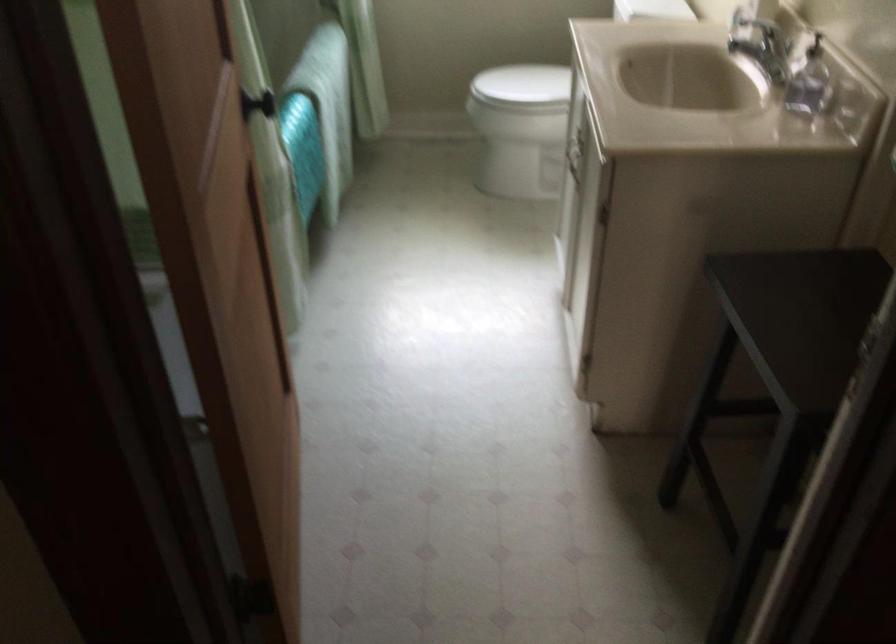
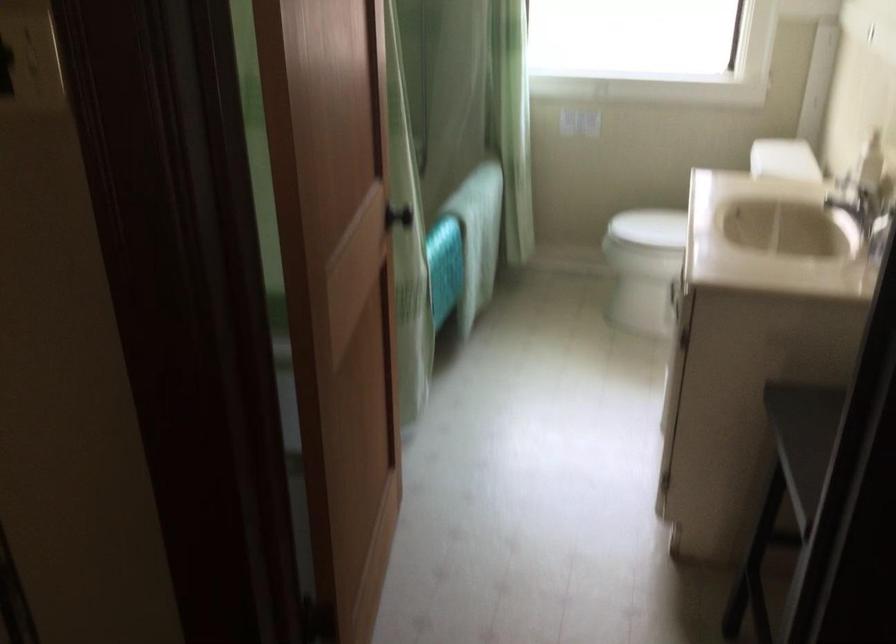
Question: The images are taken continuously from a first-person perspective. In which direction is your viewpoint rotating?

Choices:
 (A) Left
 (B) Right
 (C) Up
 (D) Down

Answer: (A)